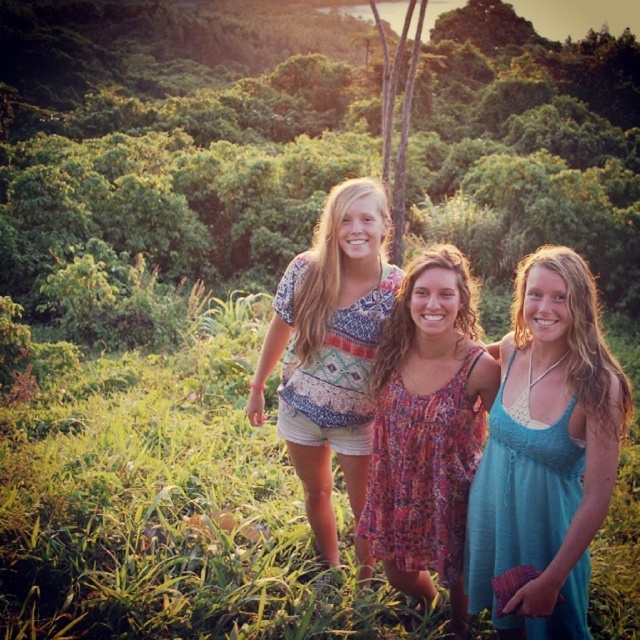
You are a photographer trying to capture a group photo of the two people in the blue fabric dress at center and the printed cotton shirt at center. Since you want to ensure both are clearly visible, which clothing item should you focus on first to avoid blurring due to their sizes?

The blue fabric dress at center is thinner than the printed cotton shirt at center, so you should focus on the printed cotton shirt at center first as it is larger and might require more attention to capture details without blurring.